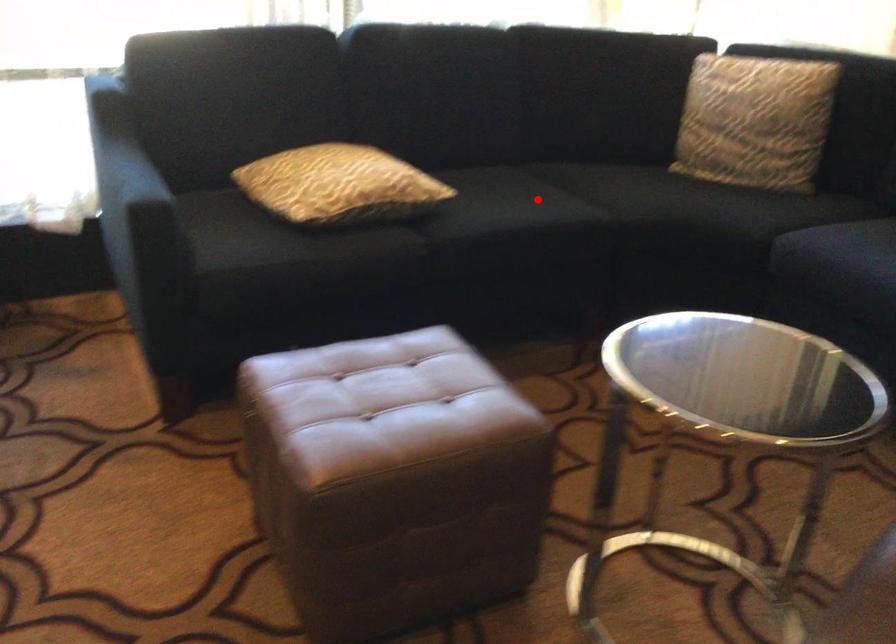
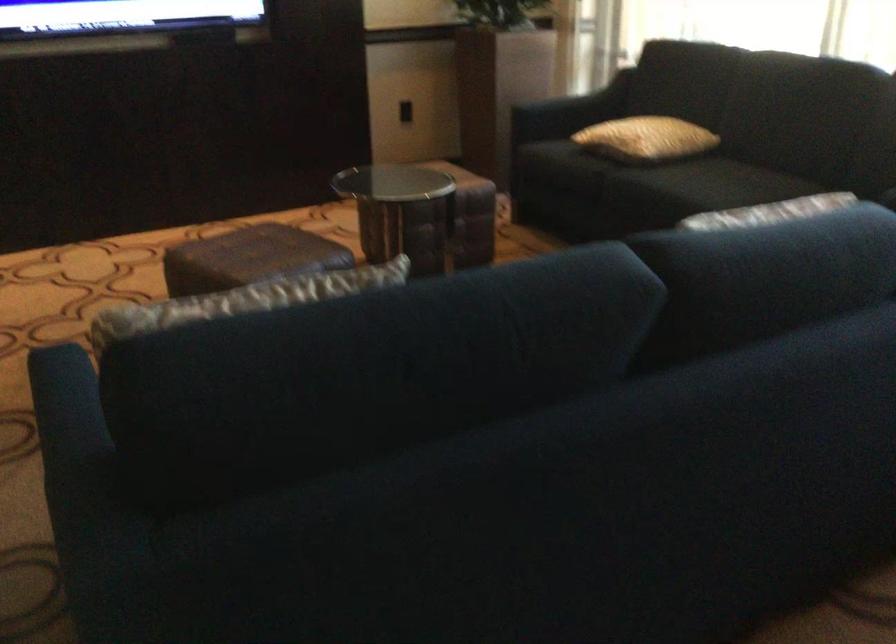
Locate, in the second image, the point that corresponds to the highlighted location in the first image.

(709, 184)